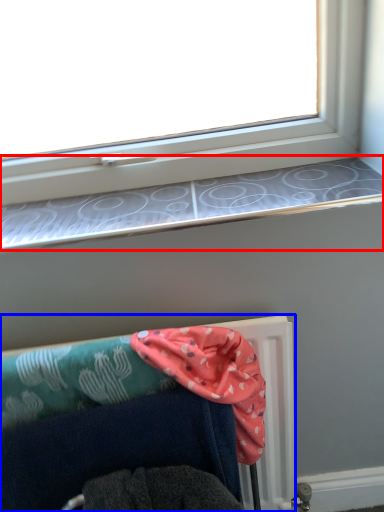
Question: Among these objects, which one is farthest to the camera, window sill (highlighted by a red box) or furniture (highlighted by a blue box)?

Choices:
 (A) window sill
 (B) furniture

Answer: (A)